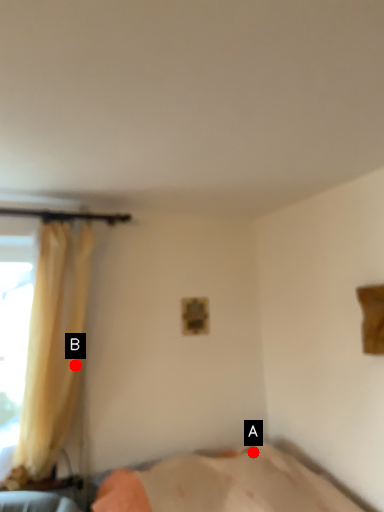
Question: Two points are circled on the image, labeled by A and B beside each circle. Which point is farther from the camera taking this photo?

Choices:
 (A) A is further
 (B) B is further

Answer: (A)